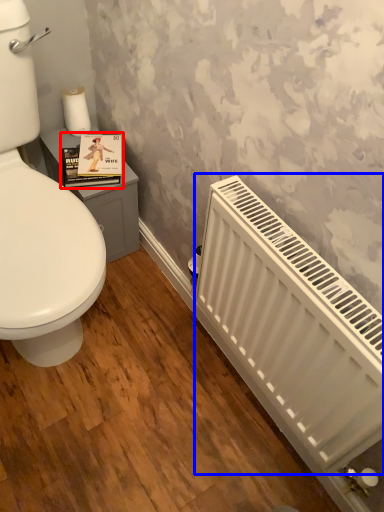
Question: Which of the following is the closest to the observer, book cover (highlighted by a red box) or radiator (highlighted by a blue box)?

Choices:
 (A) book cover
 (B) radiator

Answer: (B)